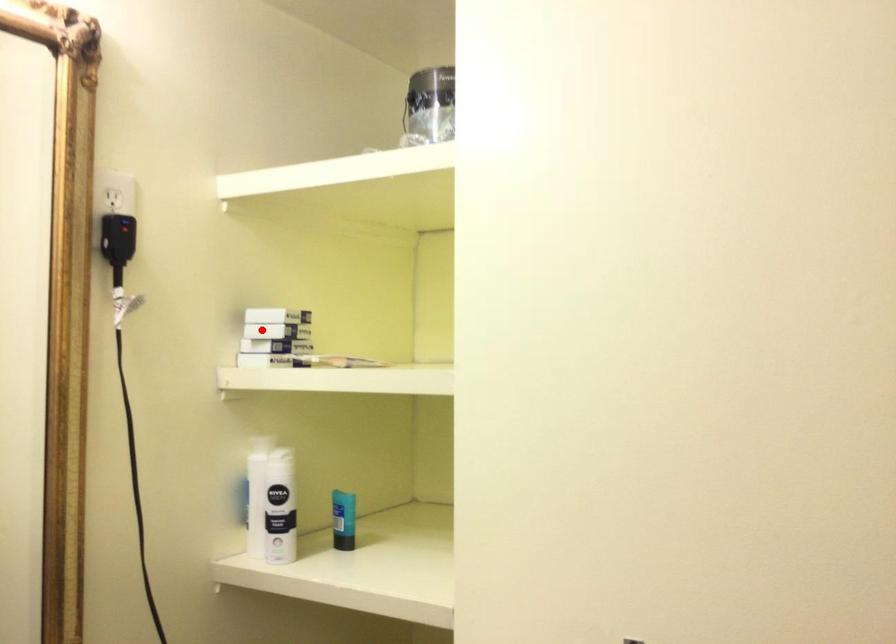
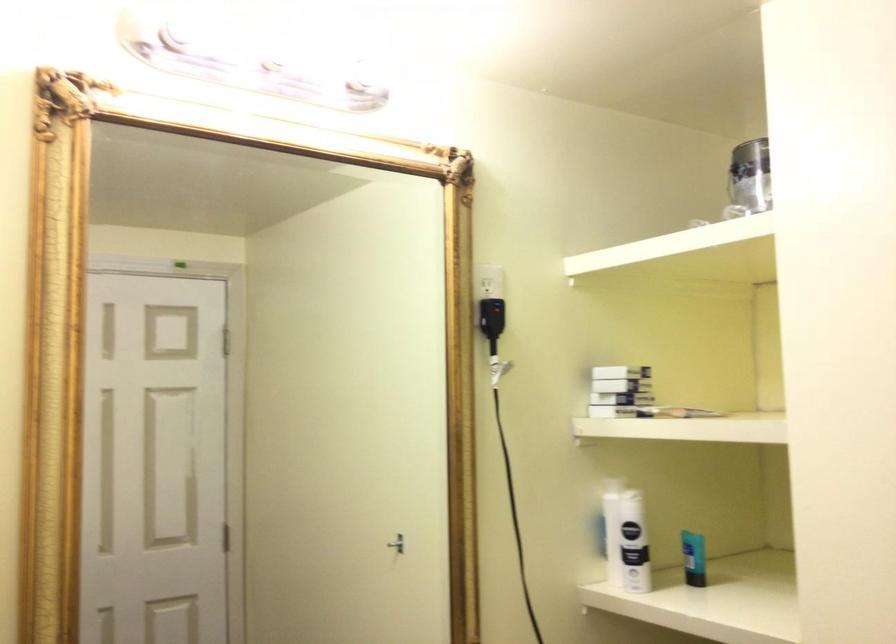
Question: A red point is marked in image1. In image2, is the corresponding 3D point closer to the camera or farther? Reply with the corresponding letter.

Choices:
 (A) The corresponding 3D point is closer.
 (B) The corresponding 3D point is farther.

Answer: (B)